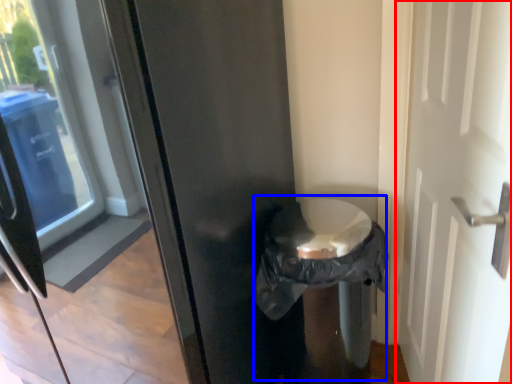
Question: Which point is closer to the camera, door (highlighted by a red box) or garbage (highlighted by a blue box)?

Choices:
 (A) door
 (B) garbage

Answer: (A)